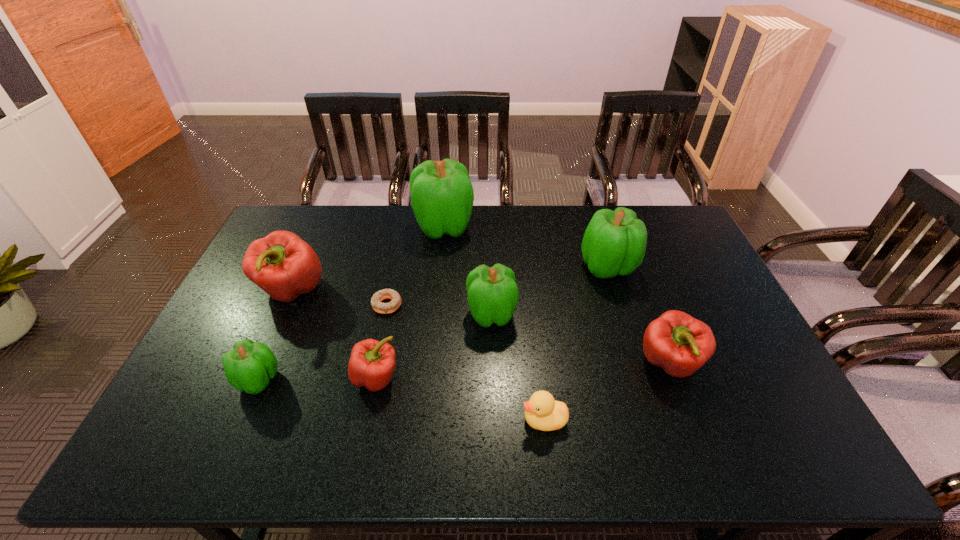
The height and width of the screenshot is (540, 960). I want to click on vacant area at the left edge of the desktop, so click(x=180, y=396).

Where is `free space at the right edge`? The height and width of the screenshot is (540, 960). free space at the right edge is located at coordinates (761, 361).

In order to click on empty space between the second pink bell pepper from left to right and the rightmost pink bell pepper in this screenshot , I will do `click(523, 371)`.

I want to click on empty location between the nearest green bell pepper and the biggest green bell pepper, so click(351, 303).

Locate an element on the screen. Image resolution: width=960 pixels, height=540 pixels. free point between the farthest green bell pepper and the third smallest green bell pepper is located at coordinates (526, 247).

Image resolution: width=960 pixels, height=540 pixels. In order to click on blank region between the second smallest pink bell pepper and the chocolate doughnut in this screenshot , I will do `click(528, 334)`.

Find the location of a particular element. Image resolution: width=960 pixels, height=540 pixels. vacant space in between the yellow duck and the third farthest green bell pepper is located at coordinates (517, 367).

The image size is (960, 540). Identify the location of empty space between the third nearest green bell pepper and the biggest green bell pepper. (526, 247).

Find the location of a particular element. The image size is (960, 540). vacant point located between the biggest pink bell pepper and the third nearest green bell pepper is located at coordinates (450, 279).

Locate an element on the screen. Image resolution: width=960 pixels, height=540 pixels. free space between the second shortest object and the biggest pink bell pepper is located at coordinates (419, 355).